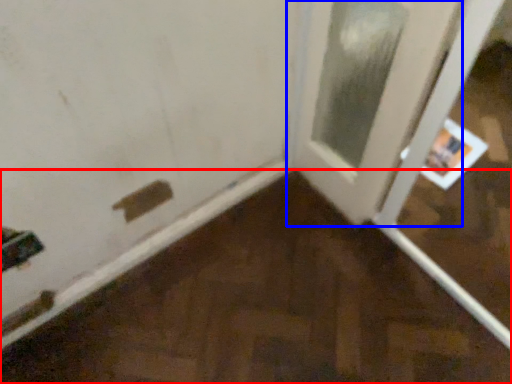
Question: Among these objects, which one is nearest to the camera, plywood (highlighted by a red box) or door (highlighted by a blue box)?

Choices:
 (A) plywood
 (B) door

Answer: (A)